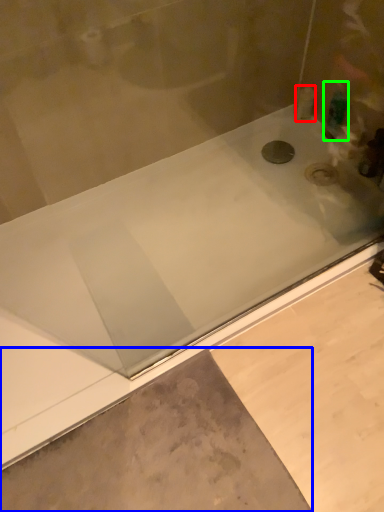
Question: Which is nearer to the toiletry (highlighted by a red box)? concrete (highlighted by a blue box) or toiletry (highlighted by a green box).

Choices:
 (A) concrete
 (B) toiletry

Answer: (B)